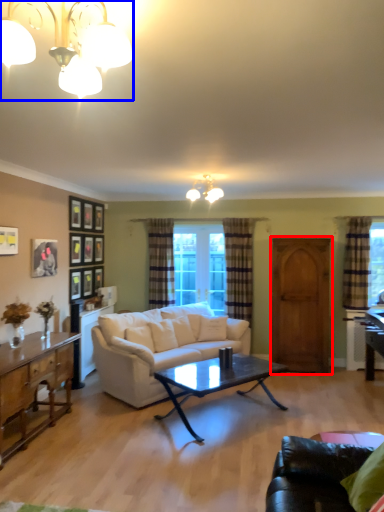
Question: Which object appears closest to the camera in this image, armoire (highlighted by a red box) or lamp (highlighted by a blue box)?

Choices:
 (A) armoire
 (B) lamp

Answer: (B)